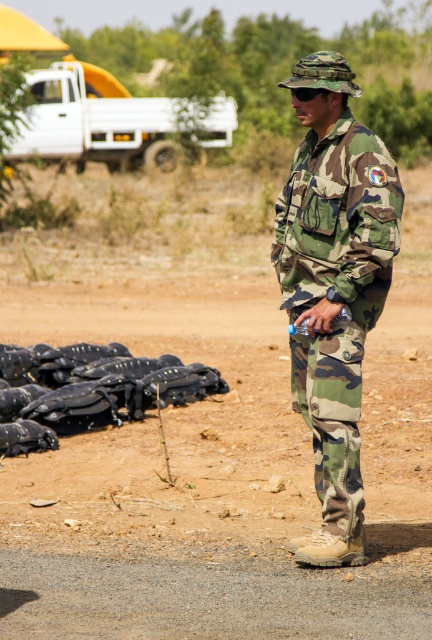
Does camo fabric uniform at center appear over black matte helmets at lower left?

Yes.

Can you confirm if camo fabric uniform at center is positioned to the right of black matte helmets at lower left?

Yes, camo fabric uniform at center is to the right of black matte helmets at lower left.

Which is in front, point (286, 220) or point (190, 381)?

Positioned in front is point (286, 220).

Locate an element on the screen. This screenshot has height=640, width=432. camo fabric uniform at center is located at coordinates (333, 285).